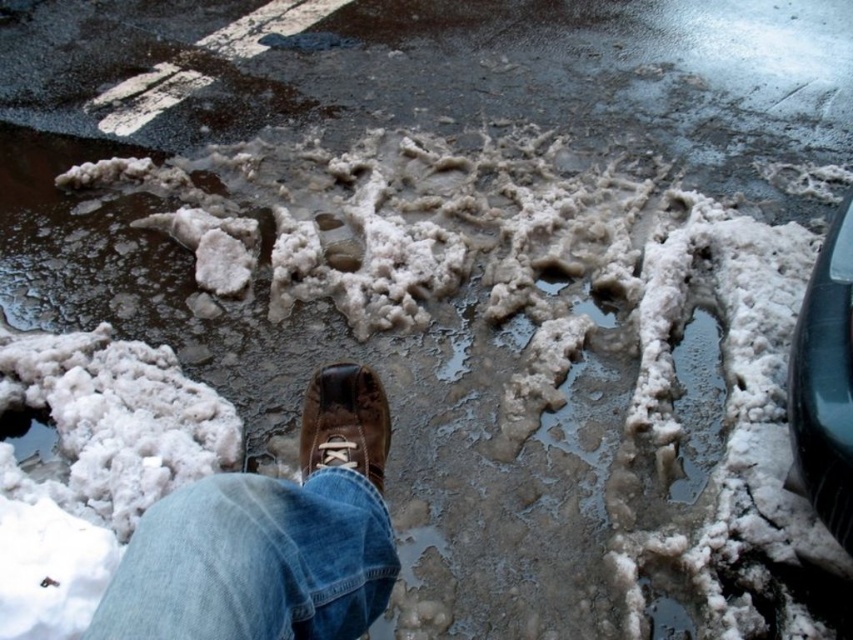
You are a delivery person trying to navigate through the slushy snow and ice to reach the shiny black car at right. Your brown leather shoe at center is stuck in the slush. Can you step sideways to reach the car without moving your shoe? Explain why based on their widths.

The shiny black car at right is wider than the brown leather shoe at center. Since the car is wider, there is enough space next to your shoe to step sideways and reach the car without moving it.

You are a pedestrian trying to walk from the brown leather shoe at center to the shiny black car at right. Is the path between them clear of any obstacles?

The shiny black car at right is above the brown leather shoe at center, so the path between them is clear of obstacles.

You are standing at the point labeled point (164, 499) and want to walk to the point labeled point (817, 403). Given the uneven and slippery ground, which direction should you move to reach your destination?

You should move downward and to the left because point (817, 403) is located below and to the left of point (164, 499).